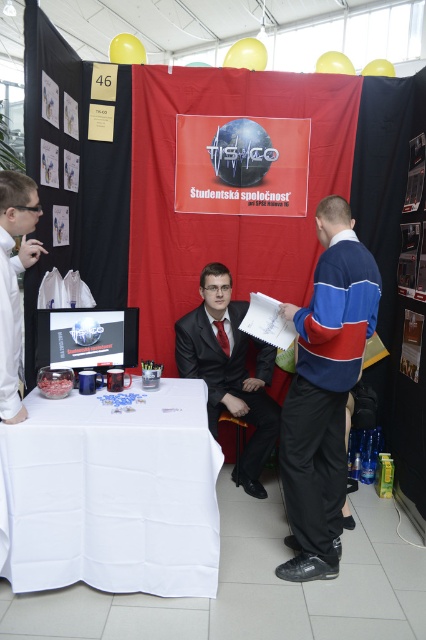
Question: Can you confirm if blue/white/red sweater at center is positioned above matte plastic poster at center?

Choices:
 (A) no
 (B) yes

Answer: (A)

Question: Is white cloth table at lower left bigger than blue/white/red sweater at center?

Choices:
 (A) yes
 (B) no

Answer: (A)

Question: Estimate the real-world distances between objects in this image. Which object is farther from the blue/white/red sweater at center?

Choices:
 (A) white cloth table at lower left
 (B) matte plastic poster at center
 (C) white glossy shirt at left
 (D) matte black suit at center

Answer: (C)

Question: Does matte plastic poster at center have a lesser width compared to matte black suit at center?

Choices:
 (A) yes
 (B) no

Answer: (B)

Question: Among these objects, which one is nearest to the camera?

Choices:
 (A) matte black suit at center
 (B) blue/white/red sweater at center
 (C) white glossy shirt at left
 (D) white cloth table at lower left

Answer: (C)

Question: Which object is farther from the camera taking this photo?

Choices:
 (A) white glossy shirt at left
 (B) matte black suit at center

Answer: (B)